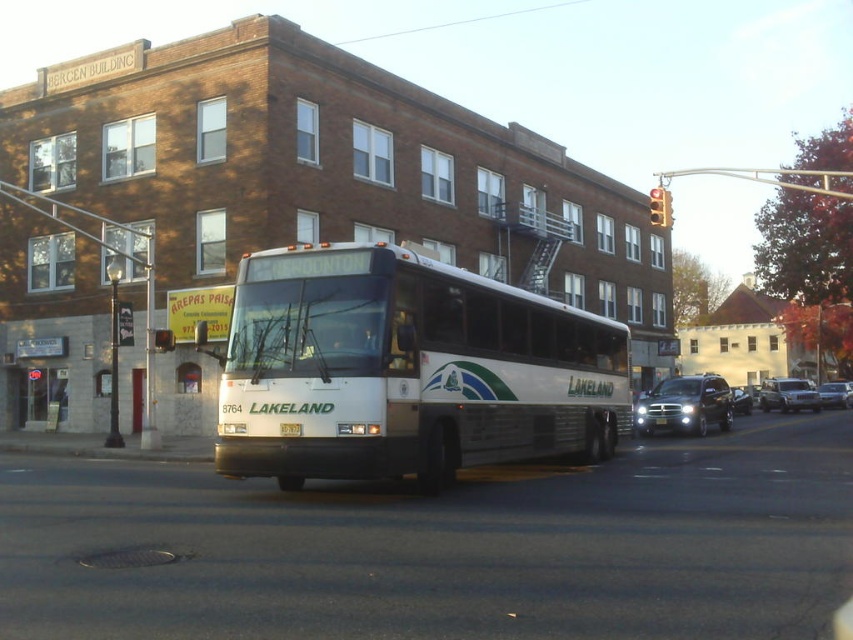
Question: Is metallic silver sedan at center positioned at the back of yellow metallic license plate at center?

Choices:
 (A) no
 (B) yes

Answer: (B)

Question: Is shiny silver sedan at center below yellow metallic license plate at center?

Choices:
 (A) yes
 (B) no

Answer: (A)

Question: Considering the real-world distances, which object is closest to the metallic silver sedan at center?

Choices:
 (A) yellow metallic license plate at center
 (B) shiny silver sedan at center
 (C) white metallic bus at center
 (D) white plastic license plate at center

Answer: (B)

Question: Which object is positioned closest to the yellow glass traffic light at upper center?

Choices:
 (A) white plastic license plate at center
 (B) shiny silver sedan at center

Answer: (A)

Question: Which of the following is the closest to the observer?

Choices:
 (A) (155, 340)
 (B) (660, 419)
 (C) (741, 394)
 (D) (785, 392)

Answer: (A)

Question: Does white metallic bus at center have a smaller size compared to silver metallic sedan at right?

Choices:
 (A) yes
 (B) no

Answer: (B)